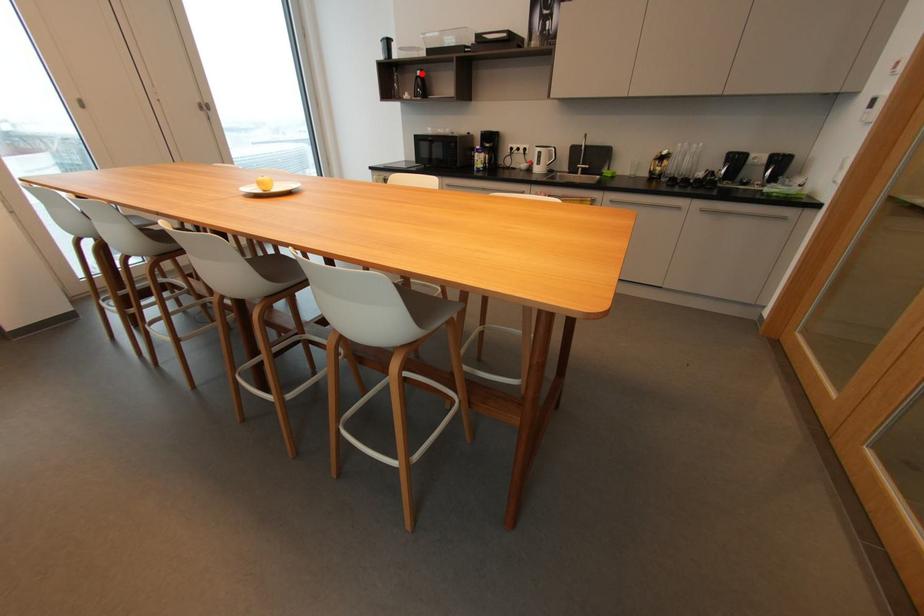
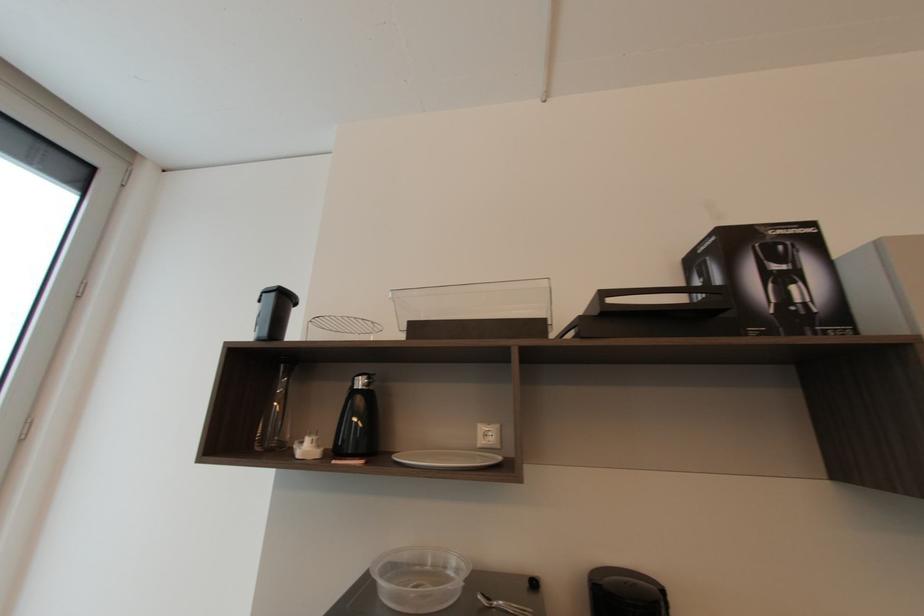
Question: I am providing you with two images of the same scene from different viewpoints. A red point is shown in image1. For the corresponding object point in image2, is it positioned nearer or farther from the camera?

Choices:
 (A) Nearer
 (B) Farther

Answer: (B)